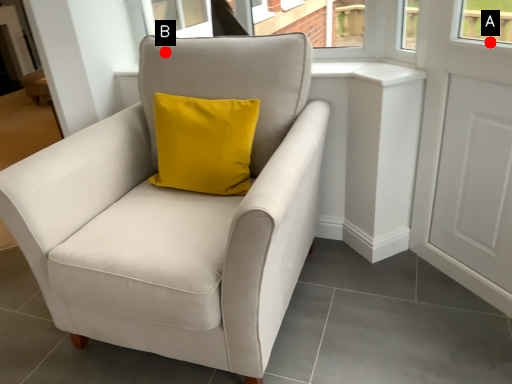
Question: Two points are circled on the image, labeled by A and B beside each circle. Which point is closer to the camera?

Choices:
 (A) A is closer
 (B) B is closer

Answer: (A)